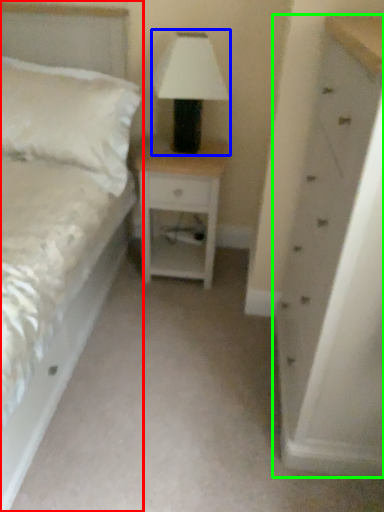
Question: Estimate the real-world distances between objects in this image. Which object is closer to bed (highlighted by a red box), table lamp (highlighted by a blue box) or chest of drawers (highlighted by a green box)?

Choices:
 (A) table lamp
 (B) chest of drawers

Answer: (A)